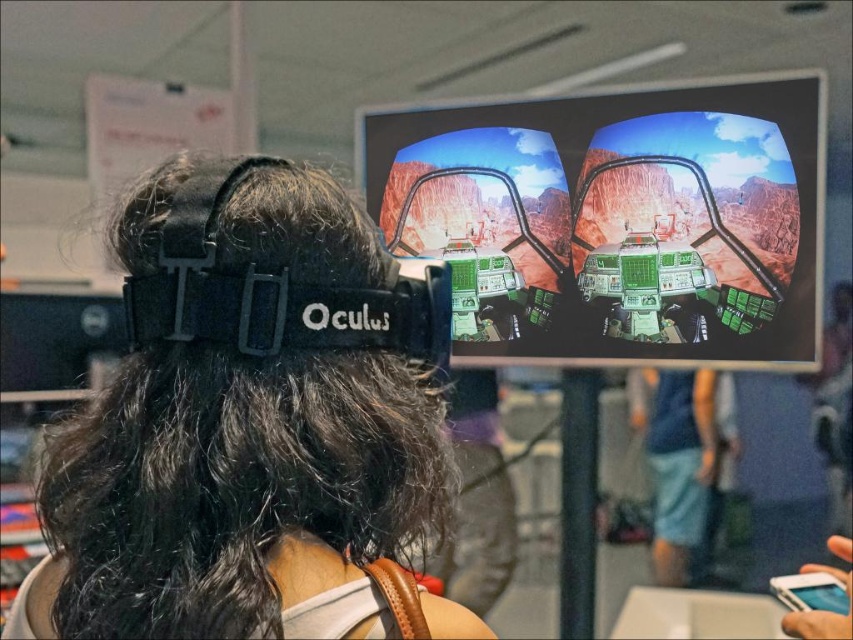
You are a virtual reality technician inspecting the setup of a user wearing the black matte vr headset at upper center and blue denim shorts at lower right. From the user perspective, which object is positioned higher?

The black matte vr headset at upper center is located above the blue denim shorts at lower right, so from the user perspective, the black matte vr headset at upper center is positioned higher.

You are setting up a VR station and need to place the green matte cockpit at center and the white matte phone at center on a desk. Based on the image, which object should be placed higher to ensure they are arranged as shown?

The green matte cockpit at center should be placed higher than the white matte phone at center because it is located above it in the image.

You are looking at a VR headset screen showing a cockpit in a desert. Where is the green matte cockpit at center located on the screen?

The green matte cockpit at center is located at point coordinates 0.344 on the x axis and 0.723 on the y axis.